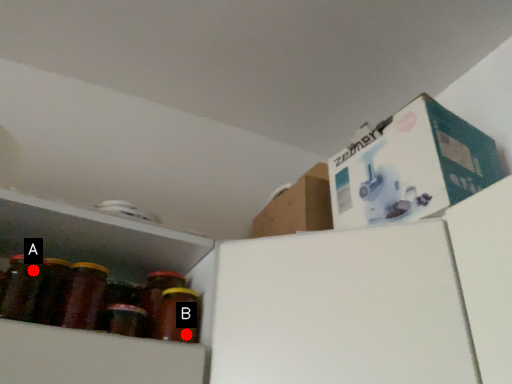
Question: Two points are circled on the image, labeled by A and B beside each circle. Which point appears farthest from the camera in this image?

Choices:
 (A) A is further
 (B) B is further

Answer: (B)